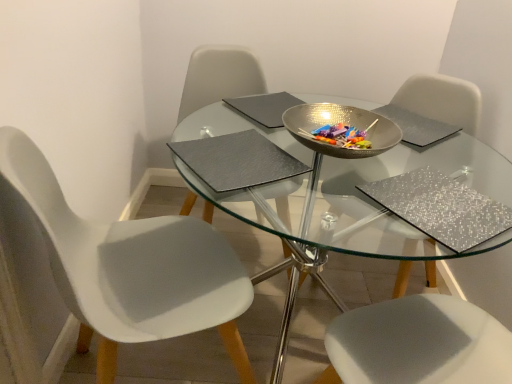
Question: Considering the relative sizes of matte gray place mat at center, which is counted as the 2th place mat, starting from the right, and white matte chair at left, which appears as the 1th chair when viewed from the left, in the image provided, is matte gray place mat at center, which is counted as the 2th place mat, starting from the right, bigger than white matte chair at left, which appears as the 1th chair when viewed from the left,?

Choices:
 (A) no
 (B) yes

Answer: (A)

Question: Is matte gray place mat at center, the 1th place mat viewed from the left, facing towards white matte chair at left, which appears as the 1th chair when viewed from the left?

Choices:
 (A) no
 (B) yes

Answer: (B)

Question: From the image's perspective, would you say matte gray place mat at center, which is counted as the 2th place mat, starting from the right, is shown under white matte chair at left, which appears as the 1th chair when viewed from the left?

Choices:
 (A) yes
 (B) no

Answer: (B)

Question: Can you confirm if matte gray place mat at center, the 1th place mat viewed from the left, is thinner than white matte chair at left, the 3th chair viewed from the right?

Choices:
 (A) yes
 (B) no

Answer: (A)

Question: Can you confirm if matte gray place mat at center, which is counted as the 2th place mat, starting from the right, is smaller than white matte chair at left, the 3th chair viewed from the right?

Choices:
 (A) no
 (B) yes

Answer: (B)

Question: Considering the relative positions of matte gray place mat at center, the 1th place mat viewed from the left, and white matte chair at left, the 3th chair viewed from the right, in the image provided, is matte gray place mat at center, the 1th place mat viewed from the left, to the left of white matte chair at left, the 3th chair viewed from the right, from the viewer's perspective?

Choices:
 (A) no
 (B) yes

Answer: (A)

Question: Is shiny metallic bowl at center located outside clear glass table at center?

Choices:
 (A) no
 (B) yes

Answer: (B)

Question: Considering the relative sizes of shiny metallic bowl at center and clear glass table at center in the image provided, is shiny metallic bowl at center bigger than clear glass table at center?

Choices:
 (A) no
 (B) yes

Answer: (A)

Question: Can you confirm if shiny metallic bowl at center is taller than clear glass table at center?

Choices:
 (A) yes
 (B) no

Answer: (B)

Question: Is shiny metallic bowl at center at the right side of clear glass table at center?

Choices:
 (A) no
 (B) yes

Answer: (B)

Question: From a real-world perspective, is shiny metallic bowl at center physically below clear glass table at center?

Choices:
 (A) yes
 (B) no

Answer: (B)

Question: Can you confirm if shiny metallic bowl at center is shorter than clear glass table at center?

Choices:
 (A) yes
 (B) no

Answer: (A)

Question: Is clear glass table at center inside silver glittery chair at upper right, which is the first chair in right-to-left order?

Choices:
 (A) no
 (B) yes

Answer: (A)